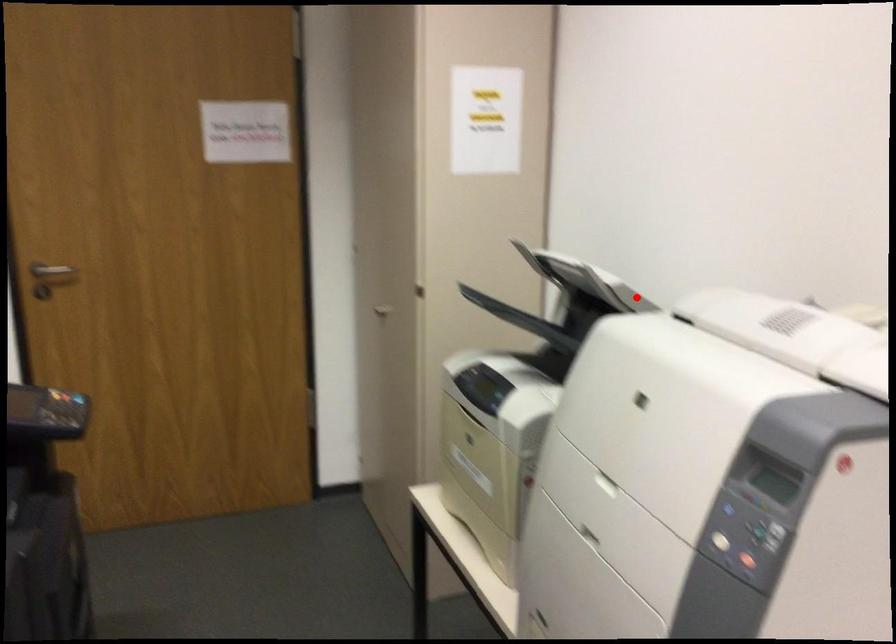
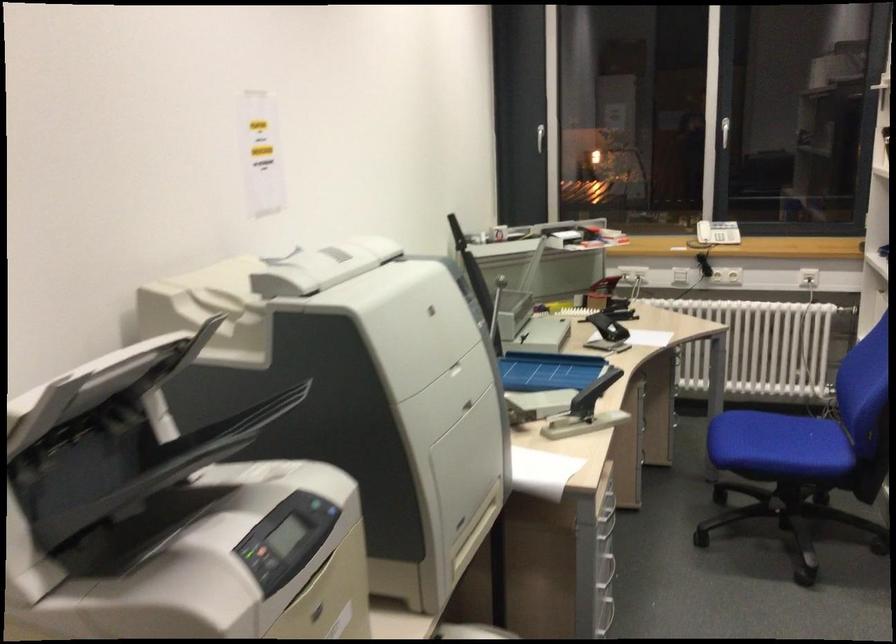
Locate, in the second image, the point that corresponds to the highlighted location in the first image.

(101, 401)